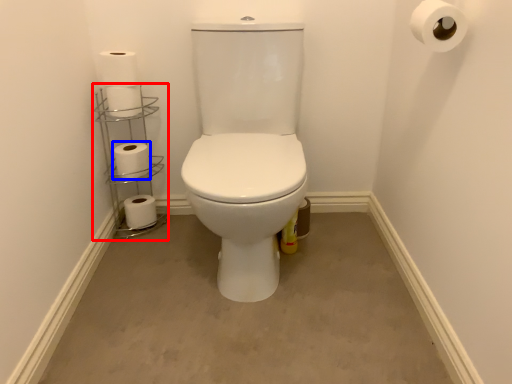
Question: Which point is further to the camera, shelf (highlighted by a red box) or toilet paper (highlighted by a blue box)?

Choices:
 (A) shelf
 (B) toilet paper

Answer: (B)